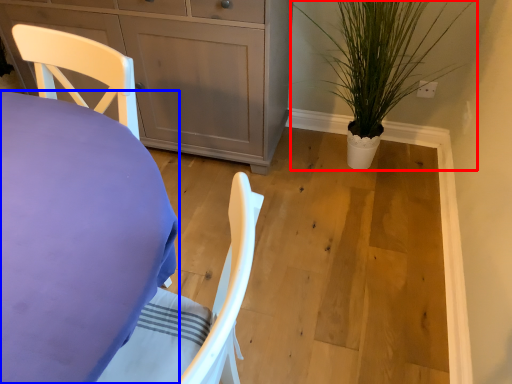
Question: Which object appears farthest to the camera in this image, houseplant (highlighted by a red box) or desk (highlighted by a blue box)?

Choices:
 (A) houseplant
 (B) desk

Answer: (A)